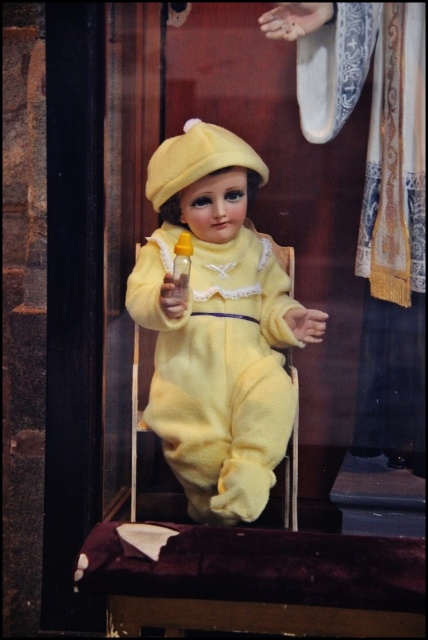
You are a toy collector trying to place both the yellow plush doll at center and the translucent yellow bottle at center on a shelf. If the shelf has enough space for only one of them, which object should you prioritize placing first based on their widths?

The yellow plush doll at center might be wider than the translucent yellow bottle at center, so you should prioritize placing the yellow plush doll at center first to ensure it fits on the shelf.

You are a toy collector who wants to display the yellow plush doll at center and the translucent yellow bottle at center on a shelf. If the shelf has a height limit of 30 cm, can both items be displayed without exceeding the height limit?

The yellow plush doll at center is taller than the translucent yellow bottle at center. However, since the exact heights are not provided, it is impossible to determine if both items will fit within the 30 cm height limit.

You are a toy collector who wants to place a new toy between the yellow plush doll at center and the translucent yellow bottle at center. The new toy is 3 inches long. Is there enough space between them to fit the toy?

The yellow plush doll at center is 6.24 inches from the translucent yellow bottle at center. Since the new toy is 3 inches long, there is enough space between them to fit the toy as 3 inches is less than 6.24 inches.